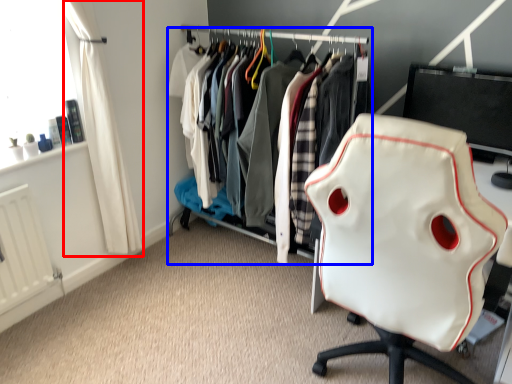
Question: Which object appears closest to the camera in this image, curtain (highlighted by a red box) or closet (highlighted by a blue box)?

Choices:
 (A) curtain
 (B) closet

Answer: (A)